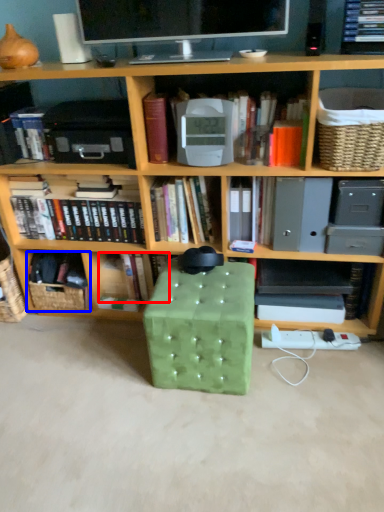
Question: Which object appears farthest to the camera in this image, book (highlighted by a red box) or basket (highlighted by a blue box)?

Choices:
 (A) book
 (B) basket

Answer: (A)